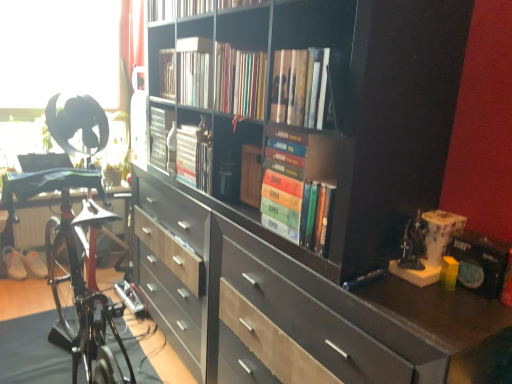
The width and height of the screenshot is (512, 384). Identify the location of vacant area that is in front of matte black paperback book at right. (476, 313).